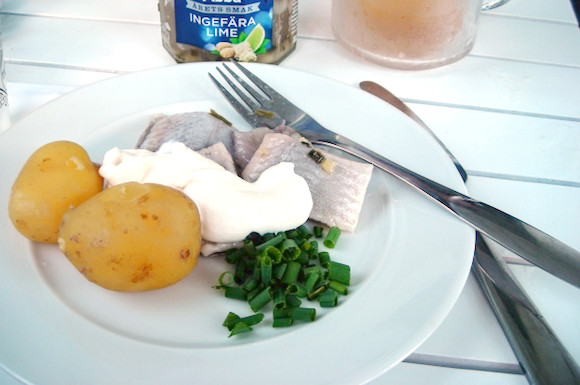
The height and width of the screenshot is (385, 580). I want to click on plate, so click(x=434, y=276).